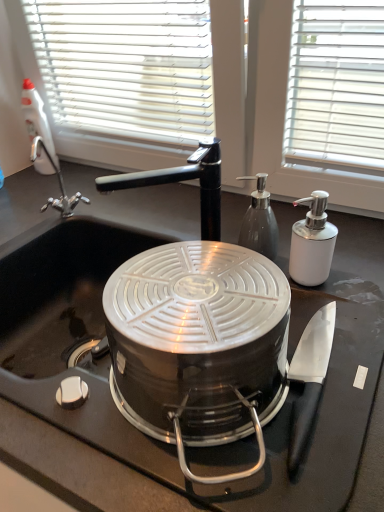
You are a GUI agent. You are given a task and a screenshot of the screen. Output one action in this format:
    pyautogui.click(x=<x>, y=<y>)
    Task: Click on the free space to the right of white plastic spray bottle at upper left
    
    Given the screenshot: What is the action you would take?
    pyautogui.click(x=80, y=172)